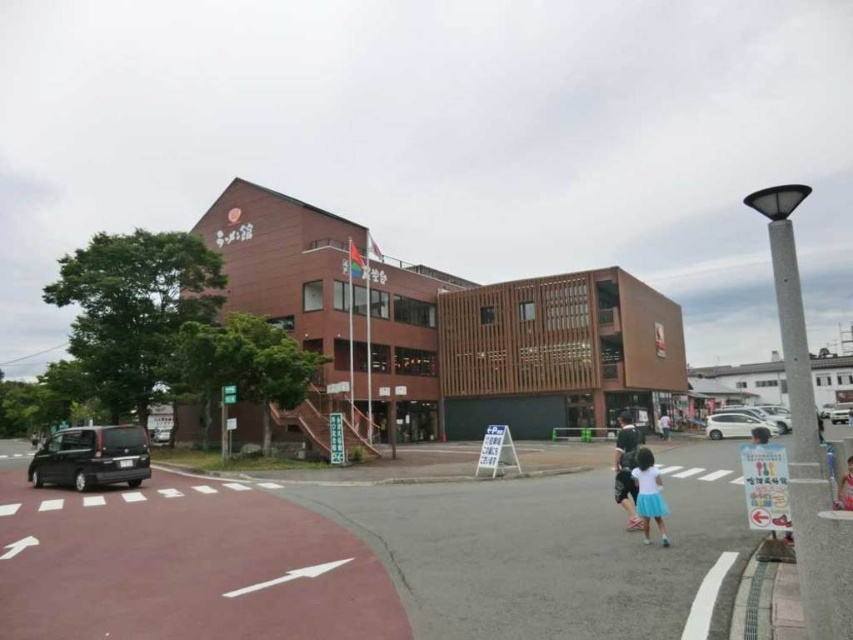
Can you confirm if satin silver sedan at right is taller than white cotton shirt at center?

Yes, satin silver sedan at right is taller than white cotton shirt at center.

Who is higher up, satin silver sedan at right or white cotton shirt at center?

Positioned higher is satin silver sedan at right.

Consider the image. Who is more distant from viewer, (x=730, y=420) or (x=665, y=438)?

Point (x=665, y=438)

I want to click on satin silver sedan at right, so click(x=735, y=426).

Does light blue skirt at lower center have a smaller size compared to light blue denim shorts at lower right?

Actually, light blue skirt at lower center might be larger than light blue denim shorts at lower right.

Is light blue skirt at lower center wider than light blue denim shorts at lower right?

In fact, light blue skirt at lower center might be narrower than light blue denim shorts at lower right.

Locate an element on the screen. light blue skirt at lower center is located at coordinates (648, 493).

Between shiny black van at lower left and light blue skirt at lower center, which one appears on the right side from the viewer's perspective?

From the viewer's perspective, light blue skirt at lower center appears more on the right side.

Where is `shiny black van at lower left`? The height and width of the screenshot is (640, 853). shiny black van at lower left is located at coordinates (91, 458).

Locate an element on the screen. The height and width of the screenshot is (640, 853). shiny black van at lower left is located at coordinates (91, 458).